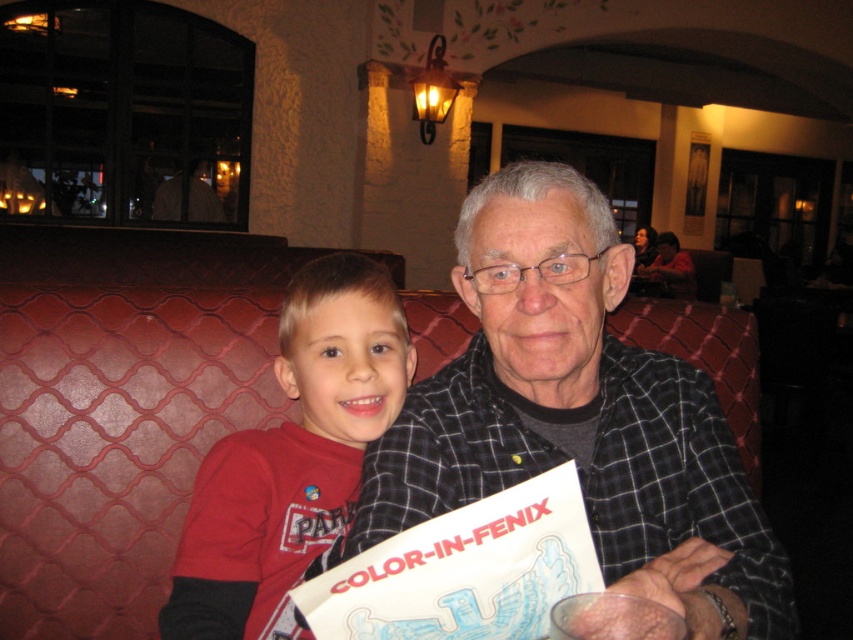
Question: Is red matte shirt at center below white paper at center?

Choices:
 (A) yes
 (B) no

Answer: (B)

Question: Based on their relative distances, which object is farther from the red matte shirt at center?

Choices:
 (A) black checkered shirt at center
 (B) white paper at center

Answer: (B)

Question: Which of the following is the closest to the observer?

Choices:
 (A) red matte shirt at center
 (B) white paper at center
 (C) black checkered shirt at center

Answer: (C)

Question: Which object is farther from the camera taking this photo?

Choices:
 (A) black checkered shirt at center
 (B) white paper at center
 (C) red matte shirt at center

Answer: (C)

Question: Observing the image, what is the correct spatial positioning of black checkered shirt at center in reference to red matte shirt at center?

Choices:
 (A) left
 (B) right

Answer: (B)

Question: Where is black checkered shirt at center located in relation to red matte shirt at center in the image?

Choices:
 (A) right
 (B) left

Answer: (A)